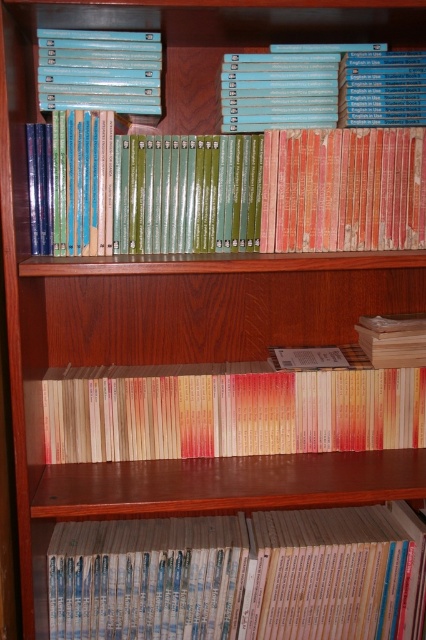
Question: Which object appears farthest from the camera in this image?

Choices:
 (A) blue hardcover books at upper center
 (B) light blue cardboard book at upper left
 (C) light beige paperbacks at lower center
 (D) wooden box at center

Answer: (D)

Question: Can you confirm if light beige paperbacks at lower center is wider than light blue cardboard book at upper left?

Choices:
 (A) no
 (B) yes

Answer: (B)

Question: Considering the relative positions of green matte book at center and beige paper book at center in the image provided, where is green matte book at center located with respect to beige paper book at center?

Choices:
 (A) above
 (B) below

Answer: (A)

Question: Observing the image, what is the correct spatial positioning of light blue cardboard book at upper left in reference to wooden box at center?

Choices:
 (A) left
 (B) right

Answer: (A)

Question: Estimate the real-world distances between objects in this image. Which object is farther from the beige paper book at center?

Choices:
 (A) blue hardcover books at upper center
 (B) wooden box at center
 (C) light blue cardboard book at upper left
 (D) green matte book at center

Answer: (C)

Question: Among these points, which one is farthest from the camera?

Choices:
 (A) (414, 76)
 (B) (275, 154)

Answer: (A)